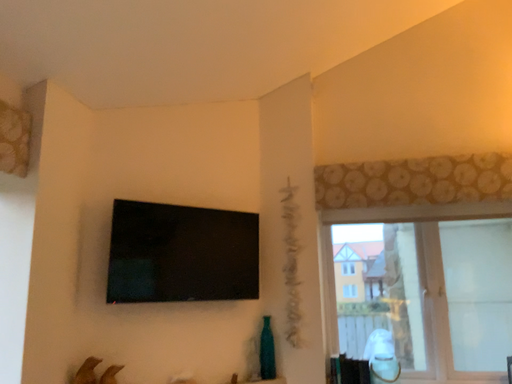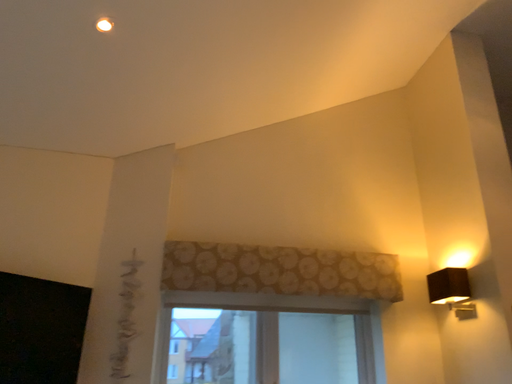
Question: How did the camera likely rotate when shooting the video?

Choices:
 (A) rotated right
 (B) rotated left

Answer: (A)